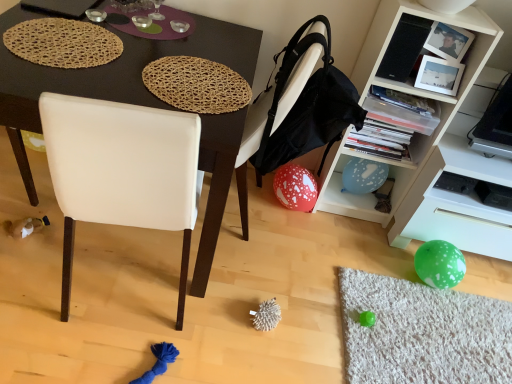
Locate an element on the screen. Image resolution: width=512 pixels, height=384 pixels. vacant space to the right of matte black desk at center is located at coordinates (303, 289).